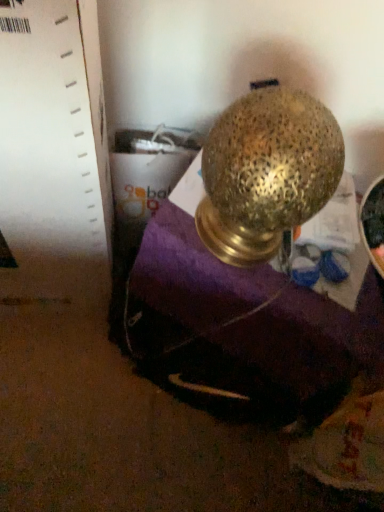
Locate an element on the screen. vacant space underneath gold textured lamp at center (from a real-world perspective) is located at coordinates (242, 257).